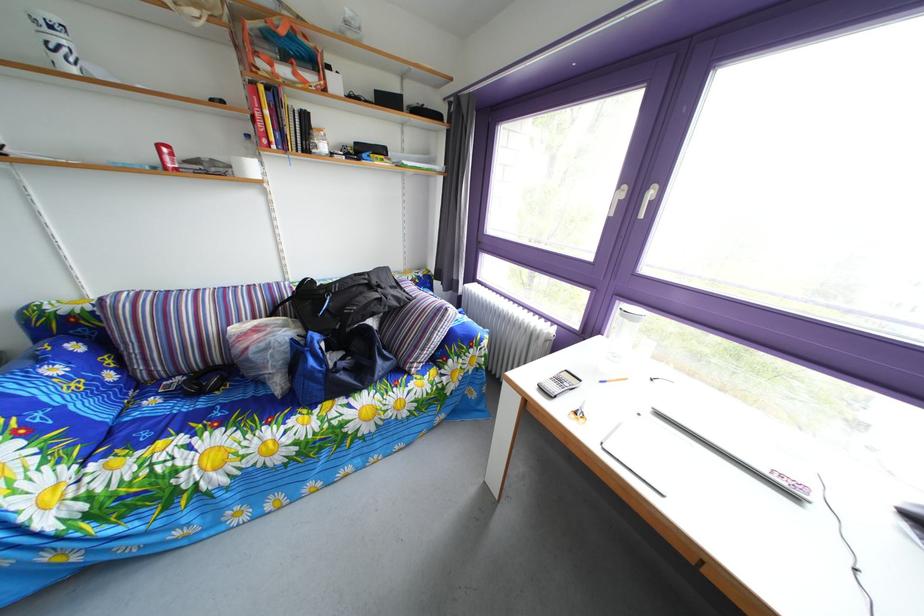
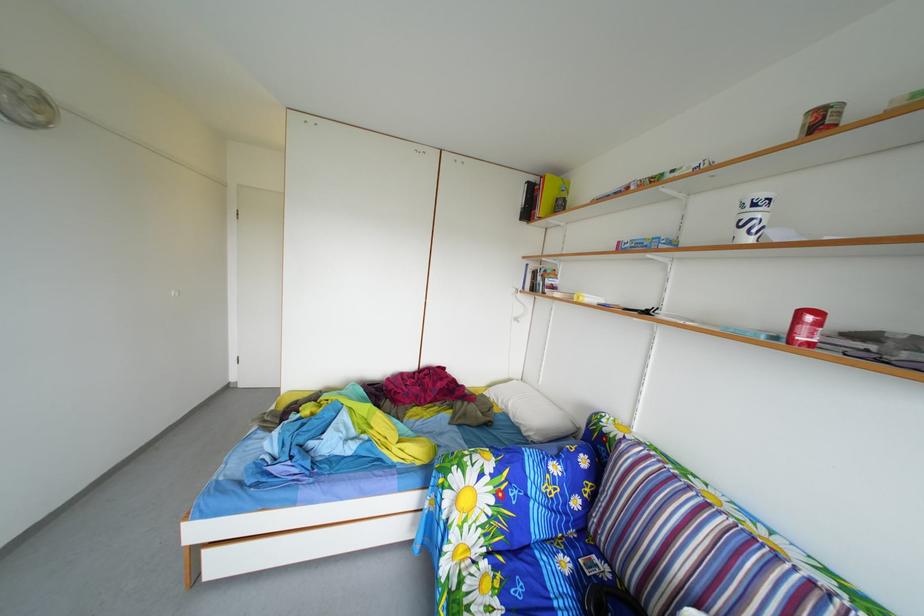
Locate, in the second image, the point that corresponds to point (169, 155) in the first image.

(811, 321)